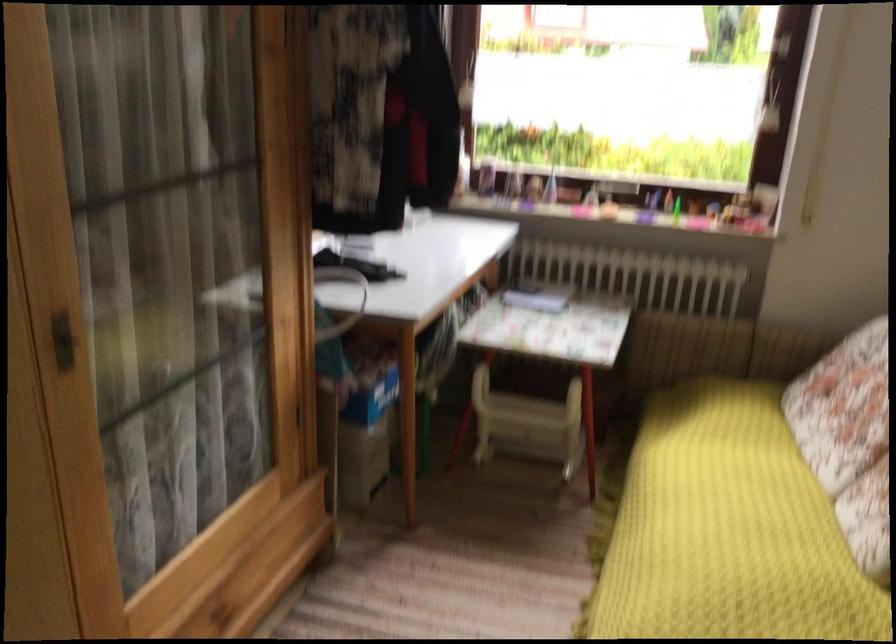
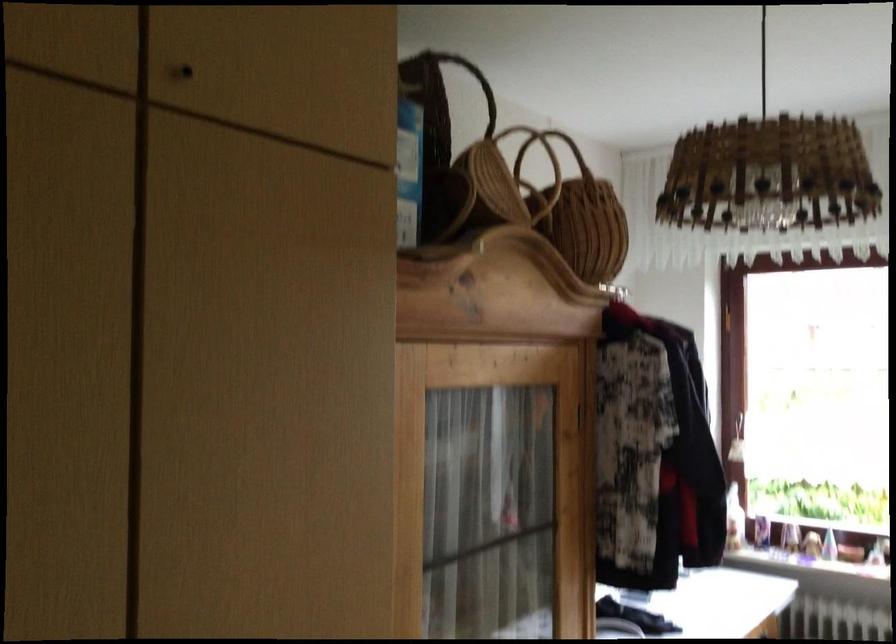
The images are taken continuously from a first-person perspective. In which direction is your viewpoint rotating?

The rotation direction of the camera is left-up.